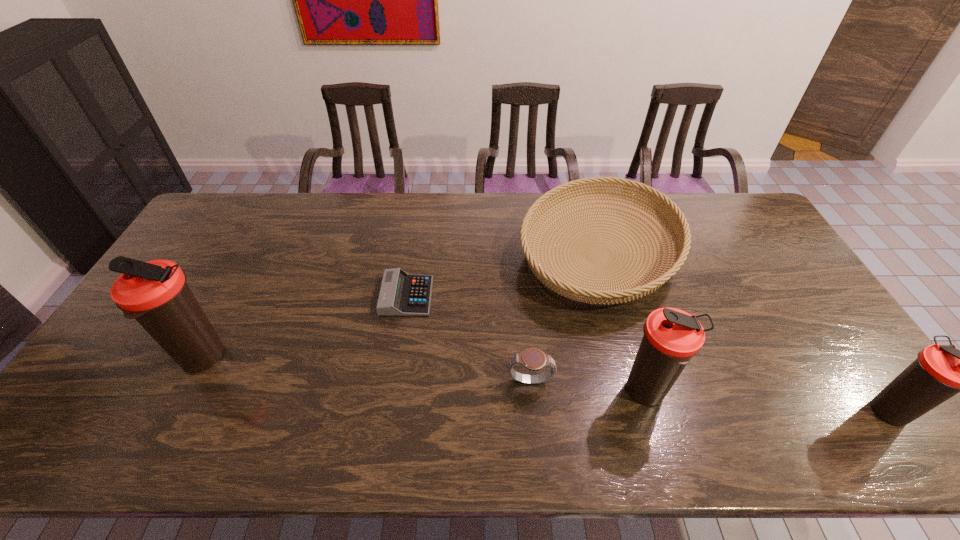
At what (x,y) coordinates should I click in order to perform the action: click on free location located 0.130m on the left of the second tallest object. Please return your answer as a coordinate pair (x, y). Looking at the image, I should click on (569, 392).

The width and height of the screenshot is (960, 540). Identify the location of vacant position located 0.080m on the back of the rightmost object. (858, 363).

Where is `vacant region located on the left of the basket`? Image resolution: width=960 pixels, height=540 pixels. vacant region located on the left of the basket is located at coordinates (484, 255).

Identify the location of vacant space situated on the front of the calculator. (393, 391).

Where is `blank space located 0.130m on the back of the watch`? Image resolution: width=960 pixels, height=540 pixels. blank space located 0.130m on the back of the watch is located at coordinates (526, 330).

Locate an element on the screen. This screenshot has width=960, height=540. object located at the far edge is located at coordinates (572, 288).

Where is `watch that is at the near edge`? Image resolution: width=960 pixels, height=540 pixels. watch that is at the near edge is located at coordinates (533, 359).

The width and height of the screenshot is (960, 540). I want to click on object that is at the right edge, so click(940, 372).

Find the location of a particular element. The image size is (960, 540). object that is at the near right corner is located at coordinates (940, 372).

Locate an element on the screen. blank area at the far edge is located at coordinates tap(322, 226).